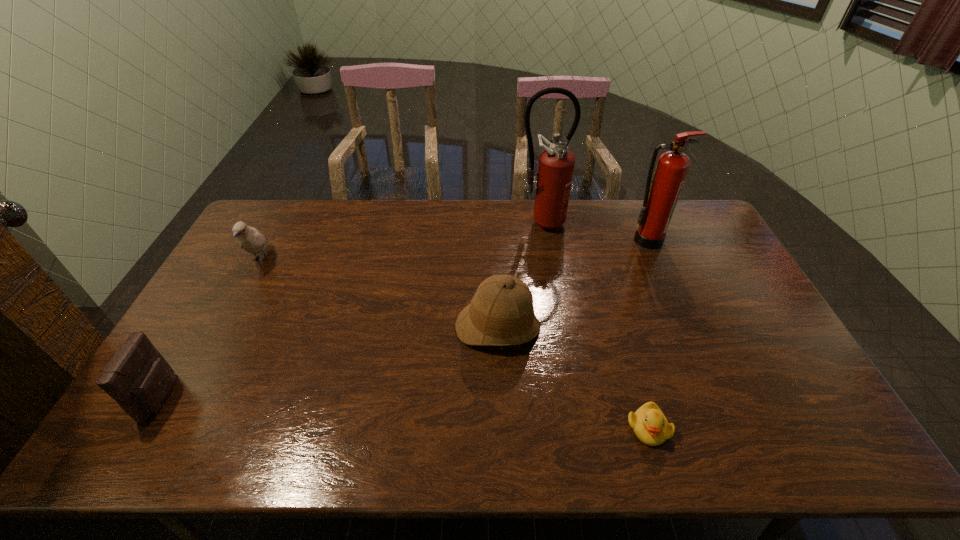
At what (x,y) coordinates should I click in order to perform the action: click on free space between the hat and the right fire extinguisher. Please return your answer as a coordinate pair (x, y). The image size is (960, 540). Looking at the image, I should click on (572, 284).

At what (x,y) coordinates should I click in order to perform the action: click on vacant area that lies between the hat and the right fire extinguisher. Please return your answer as a coordinate pair (x, y). Image resolution: width=960 pixels, height=540 pixels. Looking at the image, I should click on (572, 284).

Image resolution: width=960 pixels, height=540 pixels. Find the location of `free space that is in between the second object from left to right and the second object from right to left`. free space that is in between the second object from left to right and the second object from right to left is located at coordinates point(454,343).

Where is `vacant region between the fourth farthest object and the second object from left to right`? This screenshot has width=960, height=540. vacant region between the fourth farthest object and the second object from left to right is located at coordinates (379, 294).

This screenshot has height=540, width=960. I want to click on object that is the fifth closest one to the bird, so click(x=662, y=193).

In order to click on object that is the second closest to the left fire extinguisher in this screenshot , I will do `click(501, 313)`.

Image resolution: width=960 pixels, height=540 pixels. In order to click on free space that satisfies the following two spatial constraints: 1. at the nozzle of the taller fire extinguisher; 2. with an open flap on the pouch in this screenshot , I will do `click(569, 397)`.

I want to click on free space that satisfies the following two spatial constraints: 1. at the nozzle of the taller fire extinguisher; 2. with an open flap on the leftmost object, so click(569, 397).